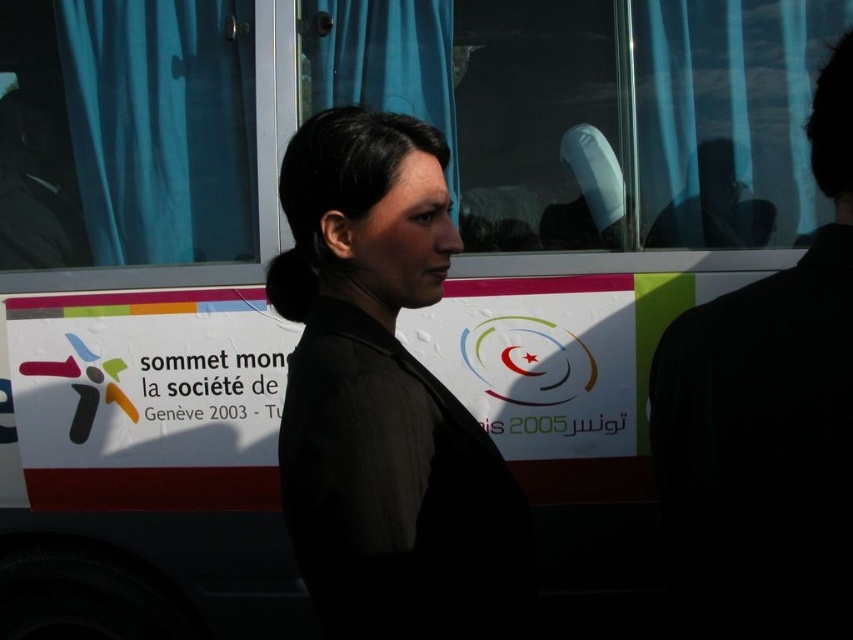
You are a tailor who needs to determine which garment requires more fabric between the black matte jacket at center and the black fabric coat at right. Based on the scene, which one would need more fabric?

The black matte jacket at center requires more fabric because its width surpasses that of the black fabric coat at right, indicating it has a larger surface area.

Based on the photo, you are a tailor measuring the distance between two black garments for a fitting. The garments are the black matte jacket at center and the black fabric coat at right. The tailor needs to ensure there is at least 18 inches between them for proper workspace. Is the current distance sufficient?

The black matte jacket at center and black fabric coat at right are 17.37 inches apart from each other, which is less than the required 18 inches. The tailor does not have enough space for proper workspace.

You are a photographer trying to capture the woman wearing the black matte jacket at center in the image. To ensure she is centered in your shot, where should you position your camera relative to her current position?

The black matte jacket at center is located at point 0.627 on the x axis and 0.453 on the y axis. To center the woman in the shot, move the camera so that the jacket is at the center coordinates of the frame.